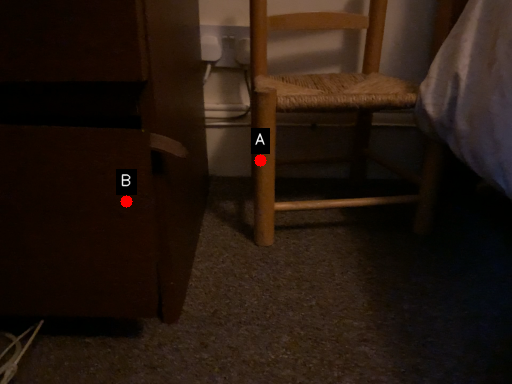
Question: Two points are circled on the image, labeled by A and B beside each circle. Among these points, which one is nearest to the camera?

Choices:
 (A) A is closer
 (B) B is closer

Answer: (B)